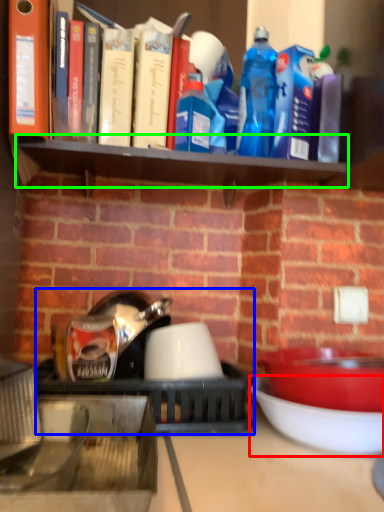
Question: Estimate the real-world distances between objects in this image. Which object is farther from bowl (highlighted by a red box), appliance (highlighted by a blue box) or shelf (highlighted by a green box)?

Choices:
 (A) appliance
 (B) shelf

Answer: (B)